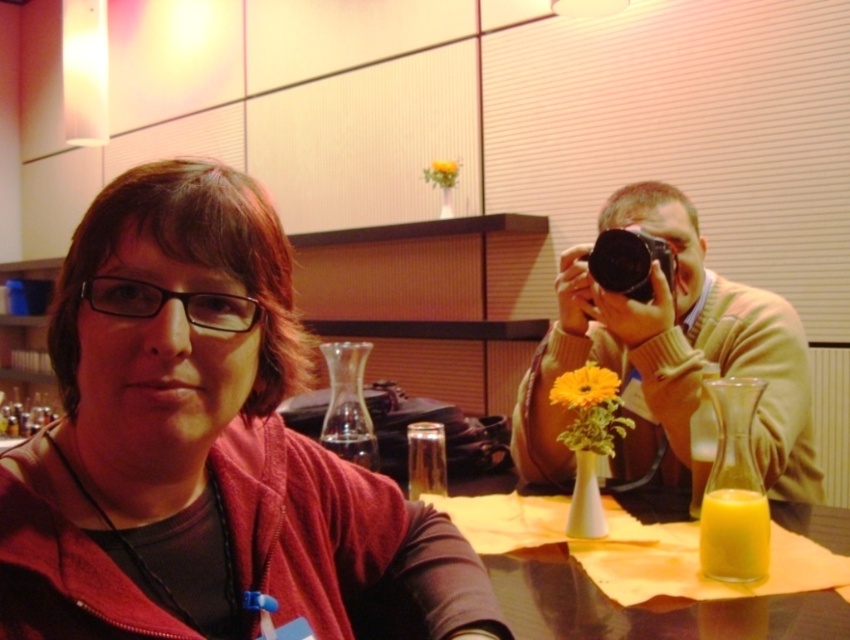
Consider the image. You are a photographer trying to capture the scene in the image. You need to place a small sticker exactly at the coordinates where the matte black glasses at upper left are located. What are the coordinates you should aim for?

The coordinates for the matte black glasses at upper left are at point [204,445].